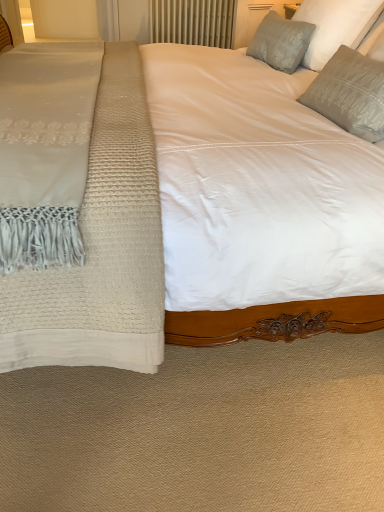
Question: Is satin gray pillow at upper right, the 1th pillow when ordered from back to front, wider than transparent glass door at upper left?

Choices:
 (A) no
 (B) yes

Answer: (A)

Question: Considering the relative positions of satin gray pillow at upper right, which is the third pillow in front-to-back order, and transparent glass door at upper left in the image provided, is satin gray pillow at upper right, which is the third pillow in front-to-back order, to the left of transparent glass door at upper left from the viewer's perspective?

Choices:
 (A) no
 (B) yes

Answer: (A)

Question: Considering the relative sizes of satin gray pillow at upper right, which is the third pillow in front-to-back order, and transparent glass door at upper left in the image provided, is satin gray pillow at upper right, which is the third pillow in front-to-back order, smaller than transparent glass door at upper left?

Choices:
 (A) no
 (B) yes

Answer: (B)

Question: Is satin gray pillow at upper right, which is the third pillow in front-to-back order, thinner than transparent glass door at upper left?

Choices:
 (A) yes
 (B) no

Answer: (A)

Question: From a real-world perspective, is satin gray pillow at upper right, which is the third pillow in front-to-back order, over transparent glass door at upper left?

Choices:
 (A) no
 (B) yes

Answer: (B)

Question: Looking at their shapes, would you say satin gray pillow at upper right, which is the third pillow in front-to-back order, is wider or thinner than transparent glass door at upper left?

Choices:
 (A) thin
 (B) wide

Answer: (A)

Question: From their relative heights in the image, would you say satin gray pillow at upper right, the 1th pillow when ordered from back to front, is taller or shorter than transparent glass door at upper left?

Choices:
 (A) short
 (B) tall

Answer: (A)

Question: Is satin gray pillow at upper right, the 1th pillow when ordered from back to front, situated inside transparent glass door at upper left or outside?

Choices:
 (A) outside
 (B) inside

Answer: (A)

Question: From a real-world perspective, is satin gray pillow at upper right, the 1th pillow when ordered from back to front, physically located above or below transparent glass door at upper left?

Choices:
 (A) below
 (B) above

Answer: (B)

Question: From their relative heights in the image, would you say satin gray pillow at upper right, acting as the 3th pillow starting from the back, is taller or shorter than transparent glass door at upper left?

Choices:
 (A) tall
 (B) short

Answer: (B)

Question: From a real-world perspective, is satin gray pillow at upper right, the first pillow viewed from the front, positioned above or below transparent glass door at upper left?

Choices:
 (A) above
 (B) below

Answer: (A)

Question: Considering their positions, is satin gray pillow at upper right, acting as the 3th pillow starting from the back, located in front of or behind transparent glass door at upper left?

Choices:
 (A) behind
 (B) front

Answer: (B)

Question: In the image, is satin gray pillow at upper right, acting as the 3th pillow starting from the back, on the left side or the right side of transparent glass door at upper left?

Choices:
 (A) right
 (B) left

Answer: (A)

Question: Do you think satin gray pillow at upper right, the first pillow viewed from the front, is within metallic radiator at upper center, or outside of it?

Choices:
 (A) outside
 (B) inside

Answer: (A)

Question: In terms of height, does satin gray pillow at upper right, acting as the 3th pillow starting from the back, look taller or shorter compared to metallic radiator at upper center?

Choices:
 (A) tall
 (B) short

Answer: (B)